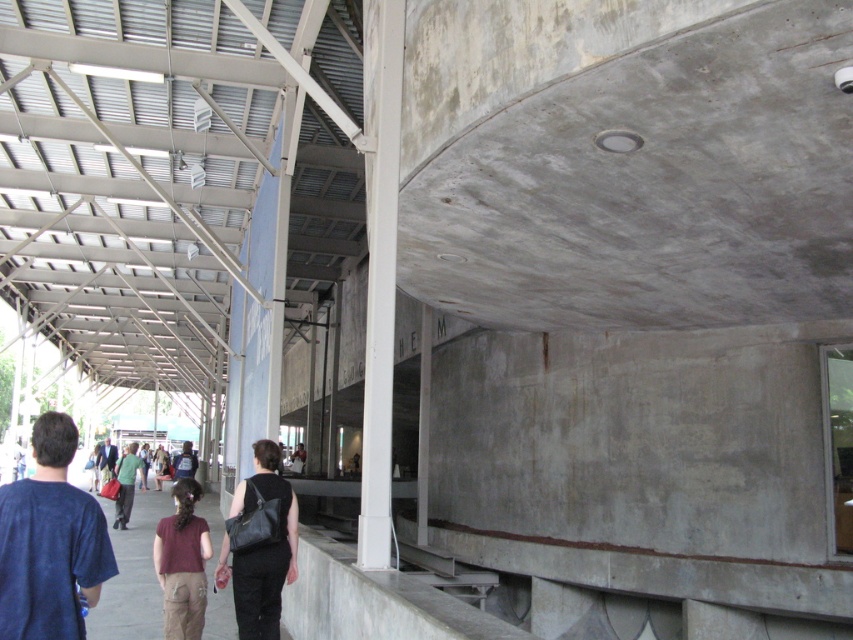
Is blue cotton shirt at lower left to the right of brown matte shirt at center from the viewer's perspective?

Indeed, blue cotton shirt at lower left is positioned on the right side of brown matte shirt at center.

In the scene shown: Which is above, blue cotton shirt at lower left or brown matte shirt at center?

blue cotton shirt at lower left is higher up.

Between point (38, 492) and point (172, 612), which one is positioned behind?

Positioned behind is point (172, 612).

Where is `blue cotton shirt at lower left`? blue cotton shirt at lower left is located at coordinates (50, 541).

Is white smooth concrete pillar at center closer to the viewer compared to black leather bag at lower center?

That is True.

Does white smooth concrete pillar at center appear over black leather bag at lower center?

Correct, white smooth concrete pillar at center is located above black leather bag at lower center.

Image resolution: width=853 pixels, height=640 pixels. What do you see at coordinates (379, 269) in the screenshot?
I see `white smooth concrete pillar at center` at bounding box center [379, 269].

Find the location of a particular element. This screenshot has height=640, width=853. white smooth concrete pillar at center is located at coordinates (379, 269).

Can you confirm if brown matte shirt at center is thinner than green matte shirt at center?

Yes.

Does brown matte shirt at center appear over green matte shirt at center?

Indeed, brown matte shirt at center is positioned over green matte shirt at center.

At what (x,y) coordinates should I click in order to perform the action: click on brown matte shirt at center. Please return your answer as a coordinate pair (x, y). Looking at the image, I should click on (183, 563).